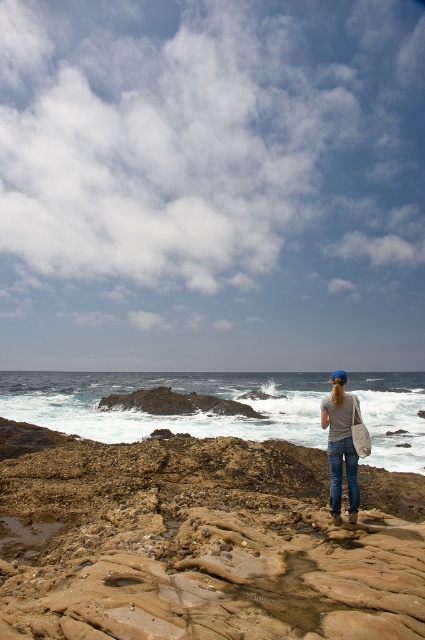
You are standing on the rocky shore and want to take a photo of the brown rock at center and the white foamy water at center. Which object will appear closer to the camera in the photo?

The brown rock at center will appear closer to the camera in the photo because it is positioned in front of the white foamy water at center.

You are a photographer trying to capture the person in the gray cotton shirt at center without the white foamy water at center appearing in the foreground. Can you adjust your angle to achieve this?

The white foamy water at center is positioned under the gray cotton shirt at center, so adjusting the angle to focus on the shirt while avoiding the water below might be challenging. However, tilting the camera upward slightly could help exclude the water from the foreground.